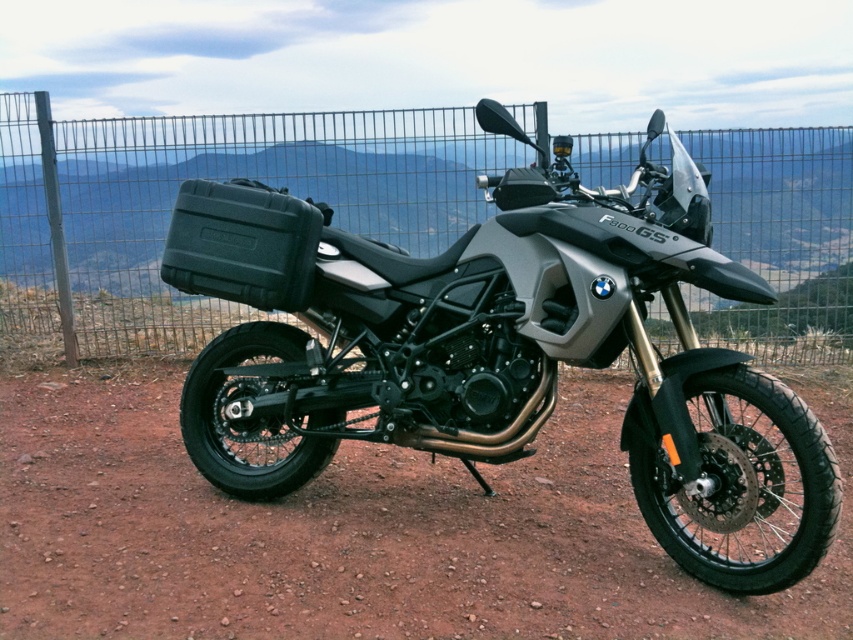
You are a photographer planning to take a picture of the matte black motorcycle at center from ground level. Considering the height difference between the motorcycle and the brown gravel dirt track at center, will the motorcycle block the view of the track behind it?

The matte black motorcycle at center is much taller than the brown gravel dirt track at center, so it will block the view of the track behind it when viewed from ground level.

You are a photographer planning to capture the matte black motorcycle at center and the brown gravel dirt track at center from a low angle. Which object will appear closer to the left edge of the photo?

The brown gravel dirt track at center will appear closer to the left edge of the photo because the matte black motorcycle at center is positioned on the right side of it.

You are standing at the viewpoint where the BMW F800GS motorcycle is parked. You want to take a photo of the motorcycle with both the brown gravel dirt track at center and the metallic wire fence at upper center in the background. Which object will appear larger in the photo?

The brown gravel dirt track at center will appear larger in the photo because it is closer to the viewer than the metallic wire fence at upper center.